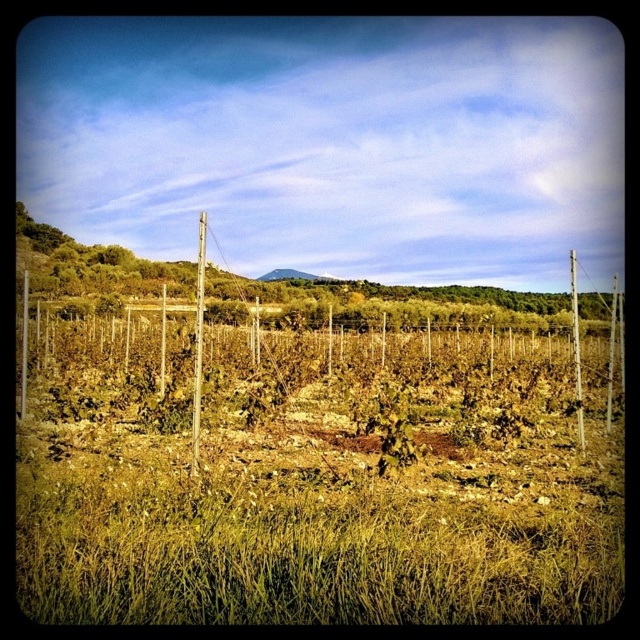
Question: Is smooth wood pole at center bigger than smooth wooden pole at right?

Choices:
 (A) yes
 (B) no

Answer: (B)

Question: Which object appears closest to the camera in this image?

Choices:
 (A) smooth wooden pole at right
 (B) smooth wood pole at center
 (C) green grassy field at center
 (D) green leafy weed at center

Answer: (C)

Question: Among these objects, which one is farthest from the camera?

Choices:
 (A) green grassy field at center
 (B) smooth wooden pole at right

Answer: (B)

Question: Does green grassy field at center have a lesser width compared to smooth wooden pole at right?

Choices:
 (A) no
 (B) yes

Answer: (B)

Question: Which object is closer to the camera taking this photo?

Choices:
 (A) green grassy field at center
 (B) smooth wood pole at center

Answer: (A)

Question: Is smooth wood pole at center in front of smooth wooden pole at right?

Choices:
 (A) yes
 (B) no

Answer: (A)